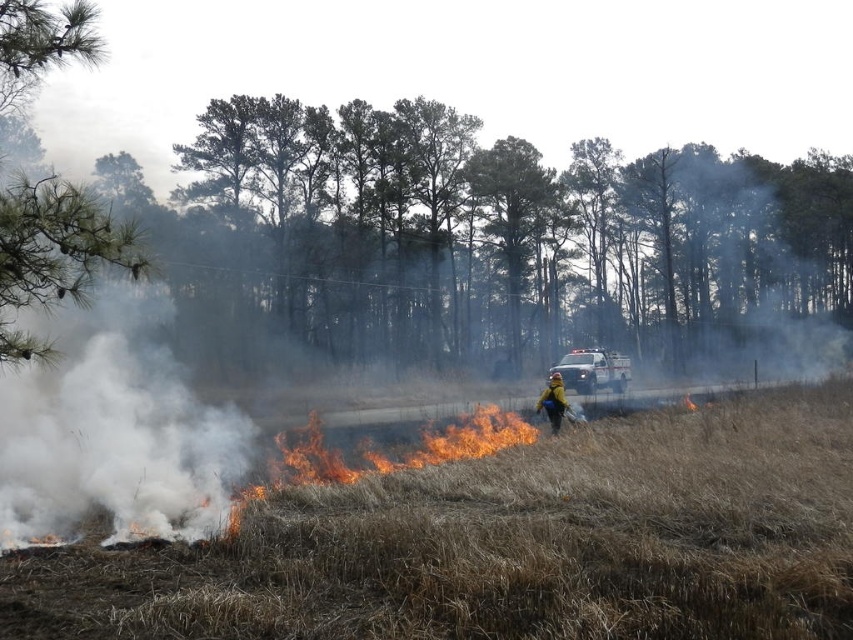
You are a firefighter trying to reach the ambulance at the scene of a controlled burn. The brown dry grass at center and the white glossy ambulance at center are in your path. Which object is closer to the ground and might pose a tripping hazard?

The brown dry grass at center is positioned under white glossy ambulance at center, so the grass is closer to the ground and could pose a tripping hazard.

You are a firefighter trying to reach the scene of a controlled burn in a grassy field. There is a white glossy ambulance at center. Based on the coordinates provided in the Objects Description, can you determine if the ambulance is positioned to the left or right of the flames?

The white glossy ambulance at center is located at point 0.580 on the x and 0.696 on the y. Since the flames are in the foreground of the image, which is typically centered, the ambulance is positioned to the right of the flames based on the x coordinate being greater than 0.5.